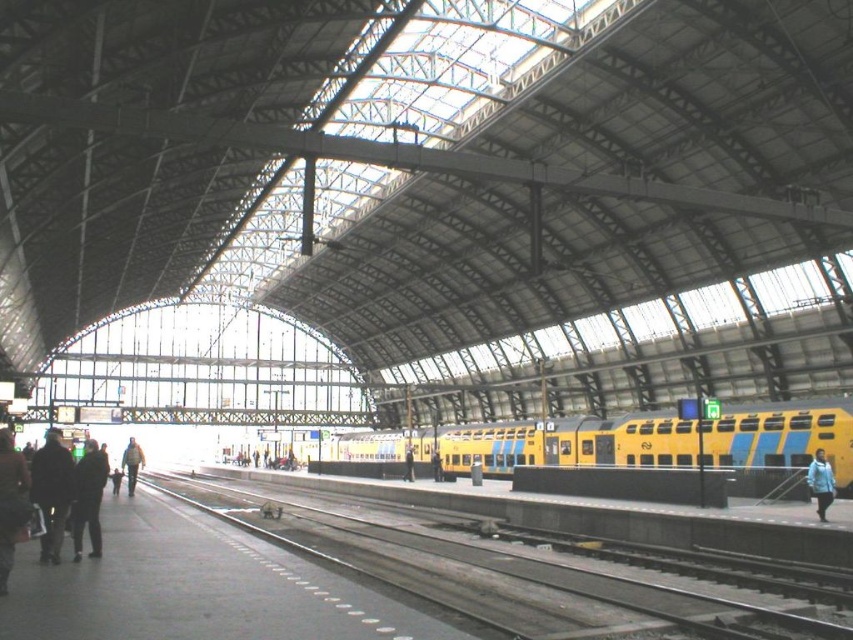
You are standing at point (404, 461) and want to walk to point (67, 490). Which direction should you move relative to your current position?

You should move forward because point (67, 490) is in front of point (404, 461).

You are a passenger waiting for your train at the station. You notice a dark brown leather jacket at left and a smooth concrete track at lower left. Which object is closer to the ground?

The smooth concrete track at lower left is closer to the ground as it is located below the dark brown leather jacket at left.

You are a passenger standing on the platform and want to board the yellow matte train at center. You notice a blue fabric jacket at lower right nearby. Which object is wider?

The yellow matte train at center is wider than the blue fabric jacket at lower right.